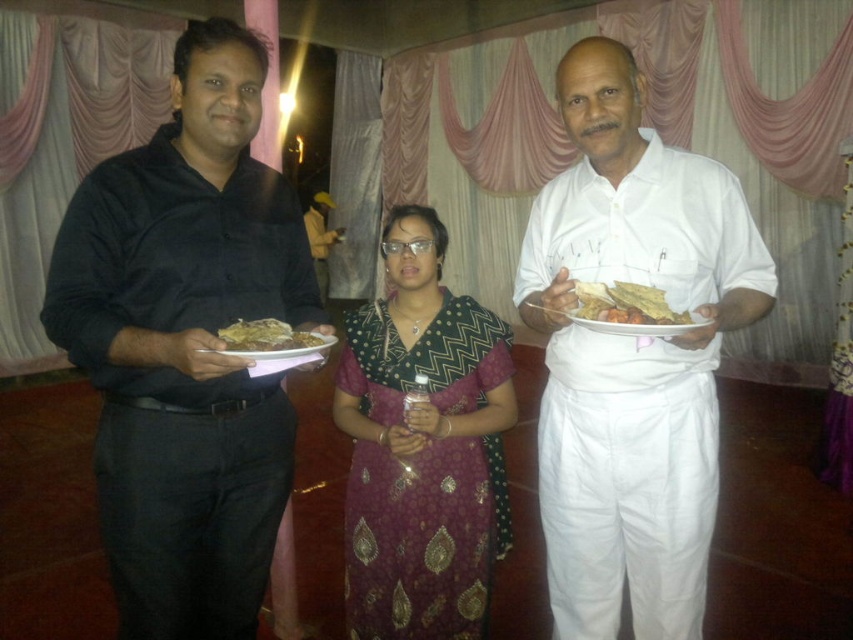
You are at a banquet hall and want to grab the golden crispy flatbread at right without disturbing the person in the center. Can you reach it from where you are standing next to the black matte shirt at left?

The black matte shirt at left is 29.65 inches away from the golden crispy flatbread at right, so yes, you can reach it from where you are standing next to the black matte shirt at left as the distance is manageable.

You are a photographer at the event and want to capture a photo of the golden crispy flatbread at right without the black matte shirt at left blocking it. How should you adjust your position?

Move to the side so that the golden crispy flatbread at right is no longer behind the black matte shirt at left.